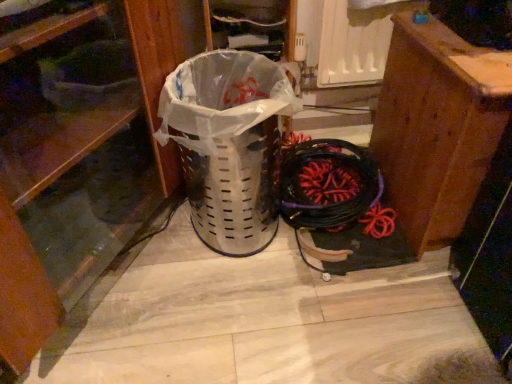
The image size is (512, 384). In order to click on brown wood cabinet at right in this screenshot , I will do `click(438, 127)`.

What do you see at coordinates (438, 127) in the screenshot? I see `brown wood cabinet at right` at bounding box center [438, 127].

You are a GUI agent. You are given a task and a screenshot of the screen. Output one action in this format:
    pyautogui.click(x=<x>, y=<y>)
    Task: Click on the brushed wood dresser at left
    This screenshot has height=384, width=512.
    Given the screenshot: What is the action you would take?
    [x=79, y=149]

Measure the distance between brushed wood dresser at left and camera.

The depth of brushed wood dresser at left is 22.27 inches.

Based on the photo, what is the approximate height of brushed wood dresser at left?

brushed wood dresser at left is 22.17 inches tall.

This screenshot has width=512, height=384. What do you see at coordinates (79, 149) in the screenshot?
I see `brushed wood dresser at left` at bounding box center [79, 149].

Find the location of a particular element. brown wood cabinet at right is located at coordinates point(438,127).

Which is more to the left, brown wood cabinet at right or brushed wood dresser at left?

Positioned to the left is brushed wood dresser at left.

From the picture: Is brown wood cabinet at right closer to the viewer compared to brushed wood dresser at left?

No, the depth of brown wood cabinet at right is greater than that of brushed wood dresser at left.

Between point (387, 166) and point (70, 75), which one is positioned in front?

The point (70, 75) is more forward.

From the image's perspective, which one is positioned higher, brown wood cabinet at right or brushed wood dresser at left?

brushed wood dresser at left.

From a real-world perspective, is brown wood cabinet at right located higher than brushed wood dresser at left?

No.

Is brown wood cabinet at right thinner than brushed wood dresser at left?

Yes.

Can you confirm if brown wood cabinet at right is taller than brushed wood dresser at left?

In fact, brown wood cabinet at right may be shorter than brushed wood dresser at left.

Considering the relative sizes of brown wood cabinet at right and brushed wood dresser at left in the image provided, is brown wood cabinet at right smaller than brushed wood dresser at left?

Indeed, brown wood cabinet at right has a smaller size compared to brushed wood dresser at left.

Do you think brown wood cabinet at right is within brushed wood dresser at left, or outside of it?

brown wood cabinet at right is not inside brushed wood dresser at left, it's outside.

Is brown wood cabinet at right touching brushed wood dresser at left?

No.

Is brown wood cabinet at right positioned with its back to brushed wood dresser at left?

No.

Can you tell me how much brown wood cabinet at right and brushed wood dresser at left differ in facing direction?

brown wood cabinet at right and brushed wood dresser at left are facing 58.1 degrees away from each other.

Measure the distance from brown wood cabinet at right to brushed wood dresser at left.

The distance of brown wood cabinet at right from brushed wood dresser at left is 23.19 inches.

The height and width of the screenshot is (384, 512). Identify the location of furniture below the brushed wood dresser at left (from the image's perspective). (438, 127).

Does brushed wood dresser at left appear on the right side of brown wood cabinet at right?

No, brushed wood dresser at left is not to the right of brown wood cabinet at right.

Between brushed wood dresser at left and brown wood cabinet at right, which one is positioned in front?

brushed wood dresser at left is closer to the camera.

Between point (127, 224) and point (388, 153), which one is positioned in front?

Positioned in front is point (127, 224).

From the image's perspective, which one is positioned higher, brushed wood dresser at left or brown wood cabinet at right?

brushed wood dresser at left.

From a real-world perspective, is brushed wood dresser at left positioned over brown wood cabinet at right based on gravity?

Correct, in the physical world, brushed wood dresser at left is higher than brown wood cabinet at right.

Between brushed wood dresser at left and brown wood cabinet at right, which one has smaller width?

brown wood cabinet at right.

Who is shorter, brushed wood dresser at left or brown wood cabinet at right?

brown wood cabinet at right.

Between brushed wood dresser at left and brown wood cabinet at right, which one has larger size?

With larger size is brushed wood dresser at left.

Is brown wood cabinet at right inside brushed wood dresser at left?

No, brown wood cabinet at right is not inside brushed wood dresser at left.

Is brushed wood dresser at left next to brown wood cabinet at right and touching it?

brushed wood dresser at left and brown wood cabinet at right are not in contact.

Could you tell me if brushed wood dresser at left is turned towards brown wood cabinet at right?

Yes, brushed wood dresser at left faces towards brown wood cabinet at right.

How different are the orientations of brushed wood dresser at left and brown wood cabinet at right in degrees?

There is a 58.1-degree angle between the facing directions of brushed wood dresser at left and brown wood cabinet at right.

The width and height of the screenshot is (512, 384). I want to click on dresser that appears in front of the brown wood cabinet at right, so click(x=79, y=149).

Locate an element on the screen. The height and width of the screenshot is (384, 512). furniture on the right of brushed wood dresser at left is located at coordinates (438, 127).

There is a brown wood cabinet at right. In order to click on dresser above it (from a real-world perspective) in this screenshot , I will do `click(79, 149)`.